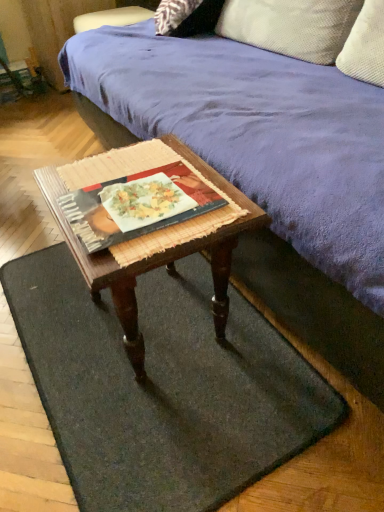
Locate an element on the screen. free point above woven wood coffee table at center (from a real-world perspective) is located at coordinates (134, 186).